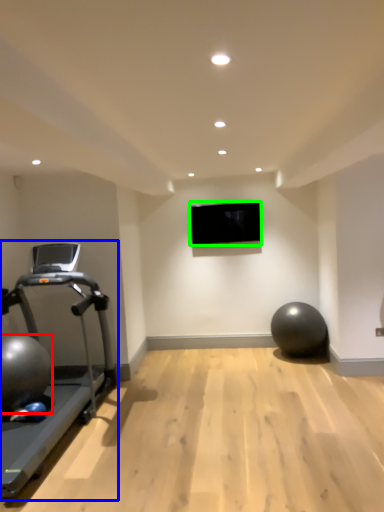
Question: Which is nearer to the ball (highlighted by a red box)? treadmill (highlighted by a blue box) or projection screen (highlighted by a green box).

Choices:
 (A) treadmill
 (B) projection screen

Answer: (A)